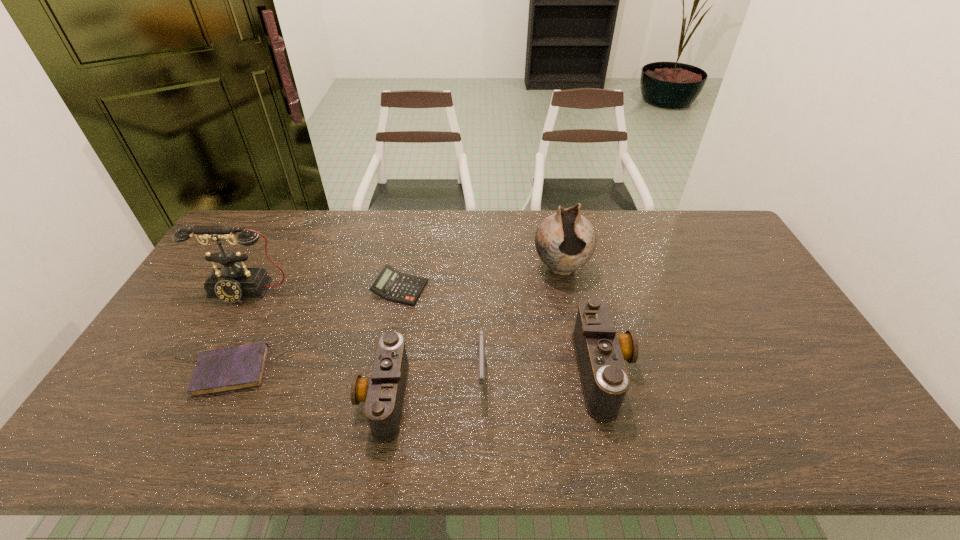
You are a GUI agent. You are given a task and a screenshot of the screen. Output one action in this format:
    pyautogui.click(x=<x>, y=<y>)
    Task: Click on the diary present at the left edge
    The width and height of the screenshot is (960, 540).
    Given the screenshot: What is the action you would take?
    pyautogui.click(x=226, y=369)

The image size is (960, 540). What are the coordinates of `object situated at the near left corner` in the screenshot? It's located at (226, 369).

This screenshot has width=960, height=540. I want to click on free space at the far edge of the desktop, so click(x=660, y=221).

Locate an element on the screen. This screenshot has width=960, height=540. free space at the near edge is located at coordinates (582, 405).

In the image, there is a desktop. Find the location of `vacant area at the left edge`. vacant area at the left edge is located at coordinates (205, 266).

I want to click on vacant position at the far left corner of the desktop, so click(264, 228).

Identify the location of vacant space that's between the calculator and the telephone. The image size is (960, 540). (323, 290).

Where is `empty space between the left camera and the telephone`? empty space between the left camera and the telephone is located at coordinates (315, 343).

In order to click on unoccupied position between the right camera and the left camera in this screenshot , I will do `click(493, 383)`.

Where is `empty space between the pottery and the shortest object`? empty space between the pottery and the shortest object is located at coordinates (396, 319).